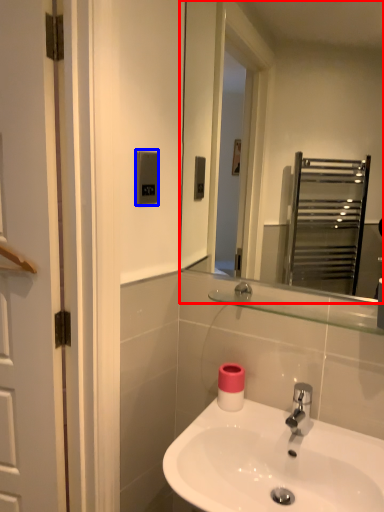
Question: Which object is closer to the camera taking this photo, mirror (highlighted by a red box) or light switch (highlighted by a blue box)?

Choices:
 (A) mirror
 (B) light switch

Answer: (A)